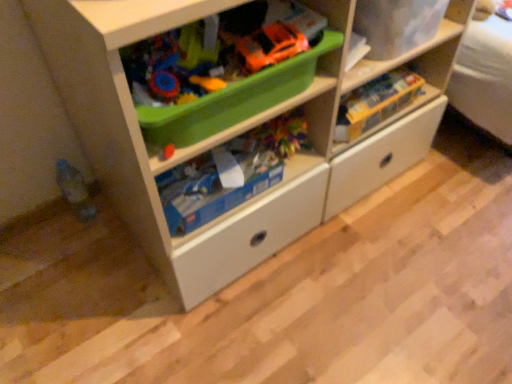
The width and height of the screenshot is (512, 384). I want to click on vacant region to the right of matte plastic toy at lower left, the first toy positioned from the left, so click(117, 228).